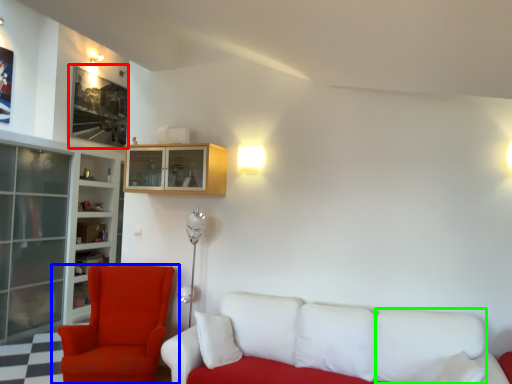
Question: Based on their relative distances, which object is farther from picture frame (highlighted by a red box)? Choose from chair (highlighted by a blue box) and pillow (highlighted by a green box).

Choices:
 (A) chair
 (B) pillow

Answer: (B)